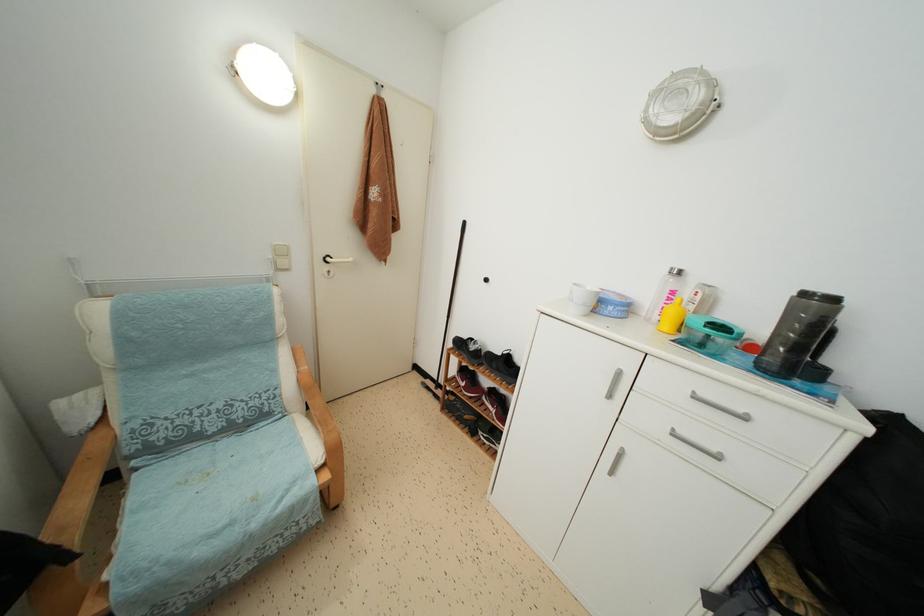
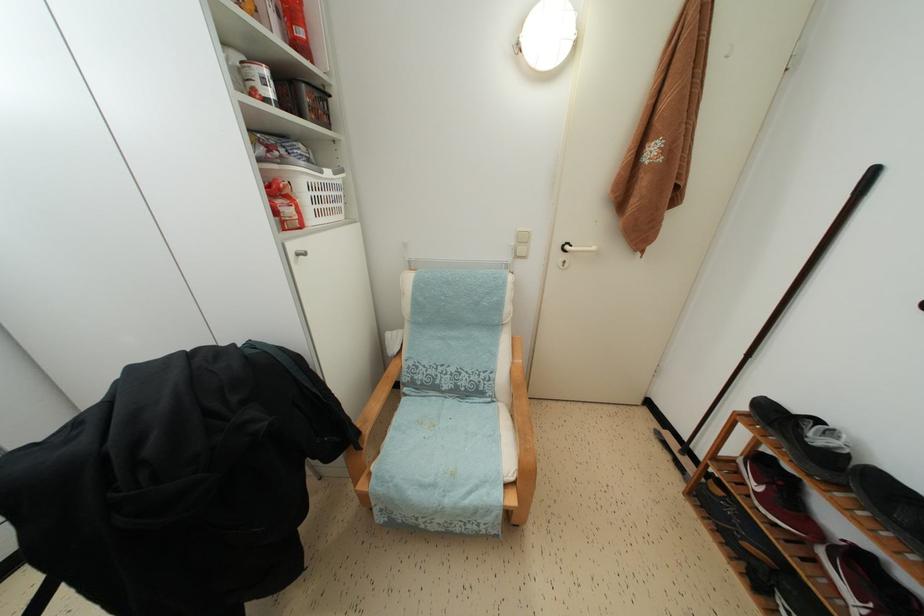
In the second image, find the point that corresponds to pixel 286 257 in the first image.

(527, 245)